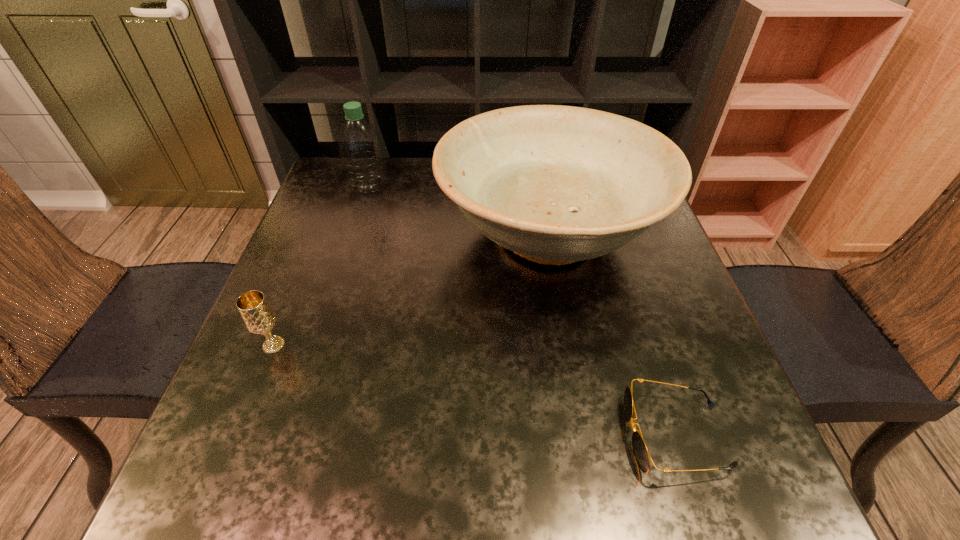
I want to click on object present at the far right corner, so click(x=555, y=184).

Identify the location of object at the near right corner. (642, 456).

In the image, there is a desktop. Where is `vacant space at the far edge`? vacant space at the far edge is located at coordinates (409, 199).

At what (x,y) coordinates should I click in order to perform the action: click on vacant space at the near edge. Please return your answer as a coordinate pair (x, y). The height and width of the screenshot is (540, 960). Looking at the image, I should click on (490, 501).

Where is `vacant space at the left edge of the desktop`? The height and width of the screenshot is (540, 960). vacant space at the left edge of the desktop is located at coordinates (291, 364).

At what (x,y) coordinates should I click in order to perform the action: click on vacant point at the right edge. Please return your answer as a coordinate pair (x, y). The height and width of the screenshot is (540, 960). Looking at the image, I should click on (687, 437).

Locate an element on the screen. The width and height of the screenshot is (960, 540). vacant space at the far left corner is located at coordinates (338, 195).

Locate an element on the screen. This screenshot has height=540, width=960. vacant space at the near left corner of the desktop is located at coordinates coord(266,495).

Identify the location of empty space between the second object from left to right and the dish. (458, 210).

This screenshot has height=540, width=960. What are the coordinates of `free area in between the sunglasses and the dish` in the screenshot? It's located at (612, 335).